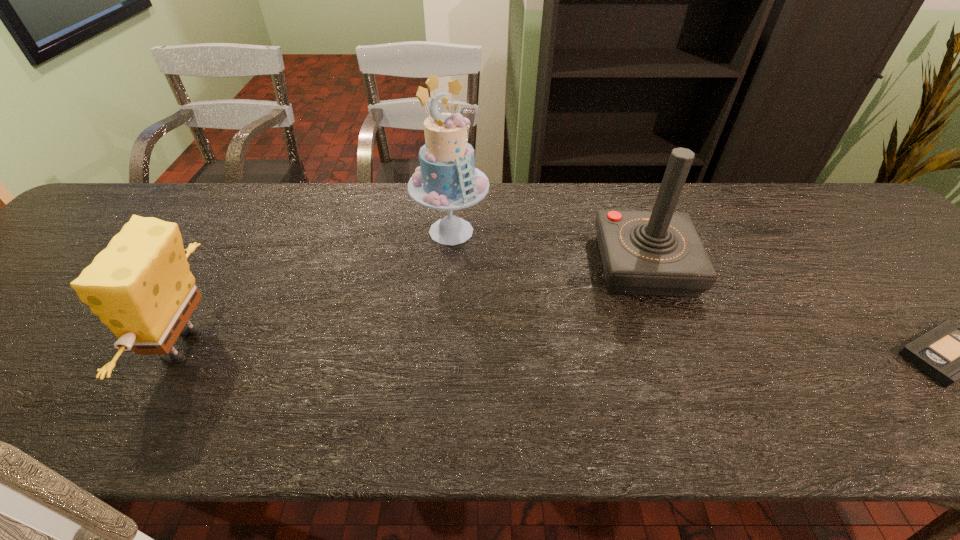
I want to click on vacant point located between the tallest object and the sponge, so (318, 288).

This screenshot has width=960, height=540. I want to click on free space between the sponge and the joystick, so click(415, 306).

Identify the location of vacant space that's between the joystick and the sponge. (415, 306).

This screenshot has width=960, height=540. Find the location of `vacant area that lies between the third object from right to left and the joystick`. vacant area that lies between the third object from right to left and the joystick is located at coordinates (547, 248).

The height and width of the screenshot is (540, 960). I want to click on free area in between the third object from right to left and the leftmost object, so click(x=318, y=288).

The height and width of the screenshot is (540, 960). I want to click on the third closest object to the rightmost object, so click(x=140, y=286).

Where is `object that is the third nearest to the sponge`? Image resolution: width=960 pixels, height=540 pixels. object that is the third nearest to the sponge is located at coordinates (949, 352).

The width and height of the screenshot is (960, 540). Identify the location of vacant space that satisfies the following two spatial constraints: 1. on the front side of the cake; 2. on the left side of the joystick. (448, 266).